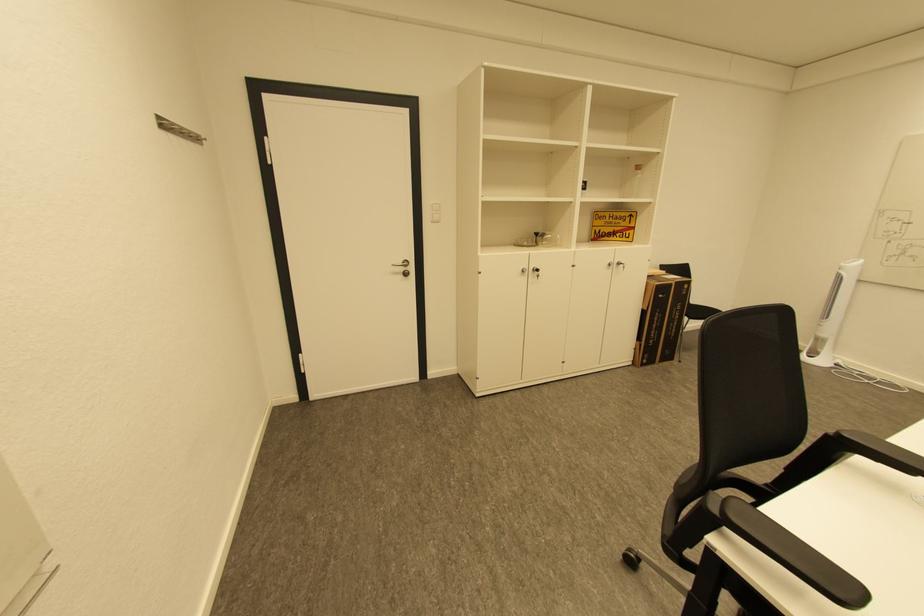
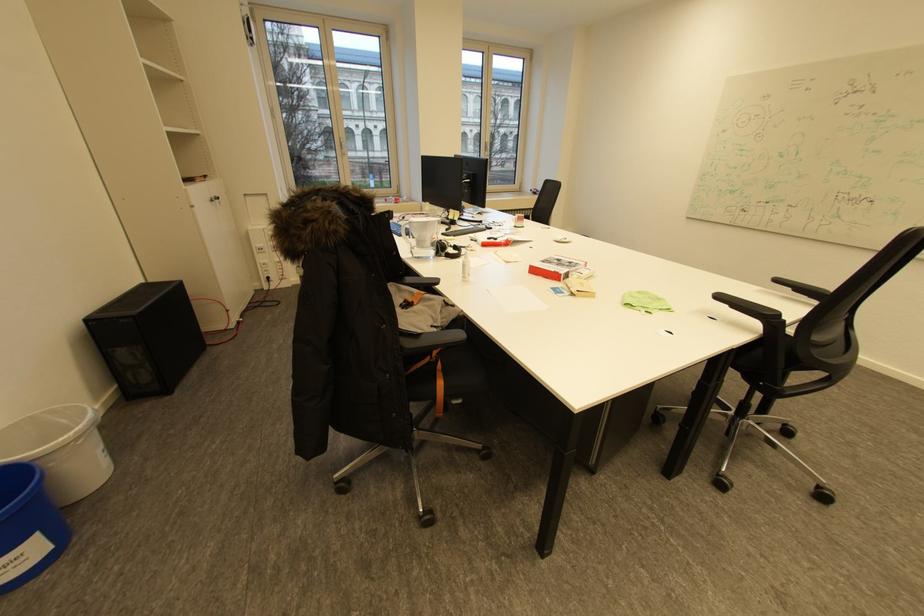
Where in the second image is the point corresponding to point (845, 436) from the first image?

(784, 315)